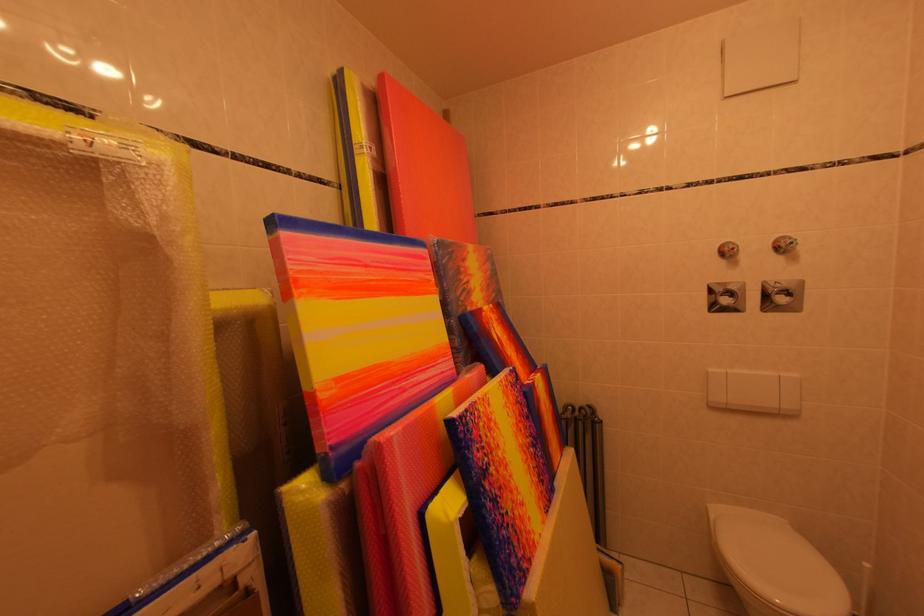
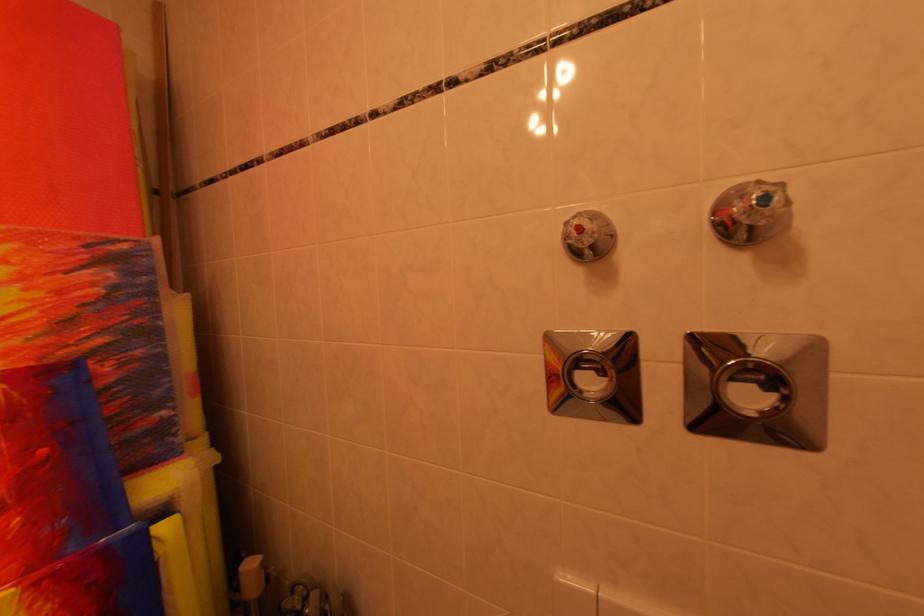
Where in the second image is the point corresponding to (799,246) from the first image?

(773, 201)